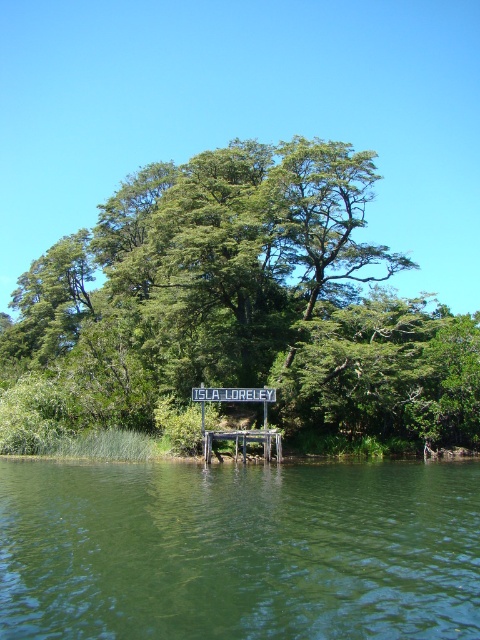
Does green leafy tree at center appear under white plastic sign at center?

Incorrect, green leafy tree at center is not positioned below white plastic sign at center.

Who is taller, green leafy tree at center or white plastic sign at center?

green leafy tree at center is taller.

Is point (166, 304) closer to camera compared to point (224, 387)?

No, (166, 304) is behind (224, 387).

The width and height of the screenshot is (480, 640). I want to click on green leafy tree at center, so click(x=243, y=304).

Who is lower down, green leafy tree at center or wooden dock at center?

Positioned lower is wooden dock at center.

Is point (130, 388) closer to camera compared to point (204, 394)?

No.

At what (x,y) coordinates should I click in order to perform the action: click on green leafy tree at center. Please return your answer as a coordinate pair (x, y). This screenshot has height=640, width=480. Looking at the image, I should click on click(243, 304).

Between green smooth water at center and wooden dock at center, which one has more height?

With more height is green smooth water at center.

Does green smooth water at center have a smaller size compared to wooden dock at center?

No, green smooth water at center is not smaller than wooden dock at center.

This screenshot has width=480, height=640. I want to click on green smooth water at center, so click(x=239, y=548).

Identify the location of green smooth water at center. The height and width of the screenshot is (640, 480). (239, 548).